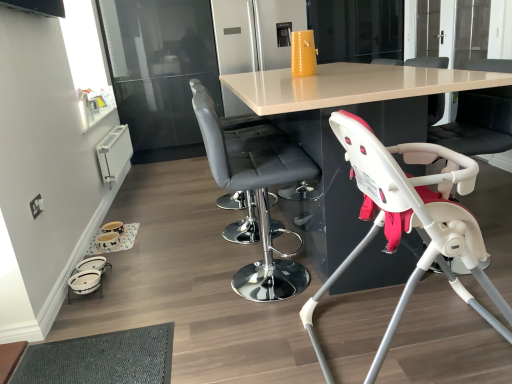
Find the location of a particular element. The height and width of the screenshot is (384, 512). free space in front of white plastic baby carriage at lower left is located at coordinates (96, 309).